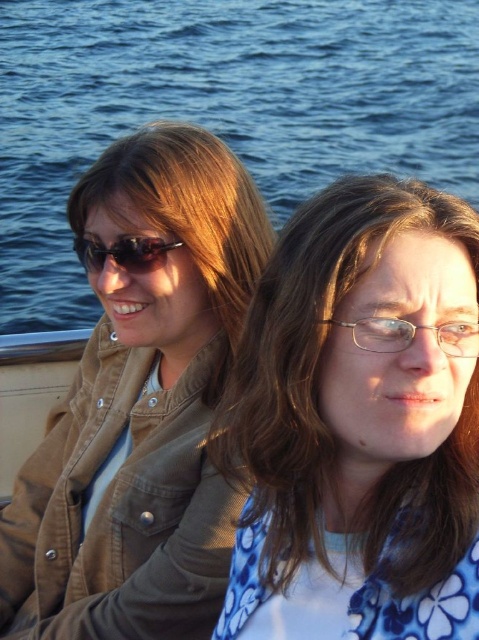
Measure the distance from matte brown jacket at left to black plastic sunglasses at upper left.

matte brown jacket at left is 38.90 inches away from black plastic sunglasses at upper left.

Which is in front, point (147, 349) or point (82, 243)?

Positioned in front is point (82, 243).

Who is more distant from viewer, (174, 573) or (90, 268)?

Positioned behind is point (90, 268).

Identify the location of matte brown jacket at left. Image resolution: width=479 pixels, height=640 pixels. [x=140, y=406].

Does blue floral shirt at center appear under matte brown jacket at left?

Yes.

Can you confirm if blue floral shirt at center is smaller than matte brown jacket at left?

Indeed, blue floral shirt at center has a smaller size compared to matte brown jacket at left.

Is point (451, 582) less distant than point (3, 536)?

That is True.

Locate an element on the screen. This screenshot has width=479, height=640. blue floral shirt at center is located at coordinates click(x=358, y=422).

Which is more to the right, blue water at upper center or black plastic sunglasses at upper left?

From the viewer's perspective, black plastic sunglasses at upper left appears more on the right side.

You are a GUI agent. You are given a task and a screenshot of the screen. Output one action in this format:
    pyautogui.click(x=<x>, y=<y>)
    Task: Click on the blue water at upper center
    
    Given the screenshot: What is the action you would take?
    pyautogui.click(x=220, y=108)

Does point (126, 40) come behind point (120, 257)?

That is True.

The width and height of the screenshot is (479, 640). Identify the location of blue water at upper center. (220, 108).